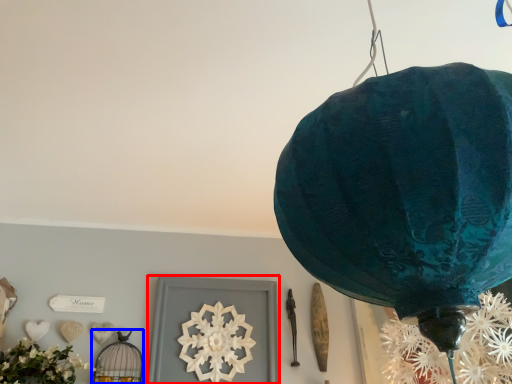
Question: Among these objects, which one is nearest to the camera, picture frame (highlighted by a red box) or lamp (highlighted by a blue box)?

Choices:
 (A) picture frame
 (B) lamp

Answer: (B)